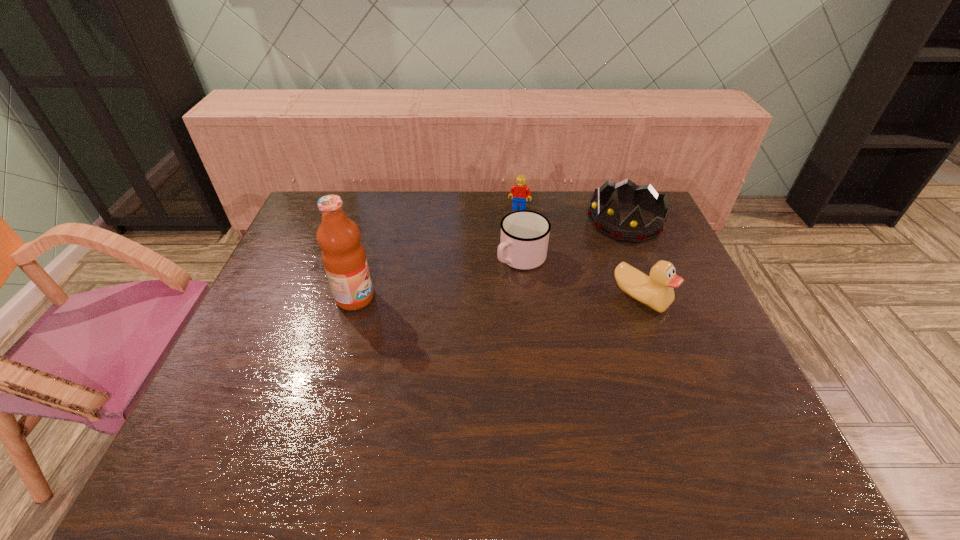
Identify the location of vacant space on the desktop that is between the fruit juice and the duck and is positioned on the face of the Lego. (491, 298).

This screenshot has height=540, width=960. I want to click on free space on the desktop that is between the leftmost object and the duck and is positioned on the side of the mug with the handle, so click(471, 298).

Locate an element on the screen. This screenshot has height=540, width=960. vacant spot on the desktop that is between the leftmost object and the duck and is positioned at the front of the fourth shortest object with jewels is located at coordinates (526, 298).